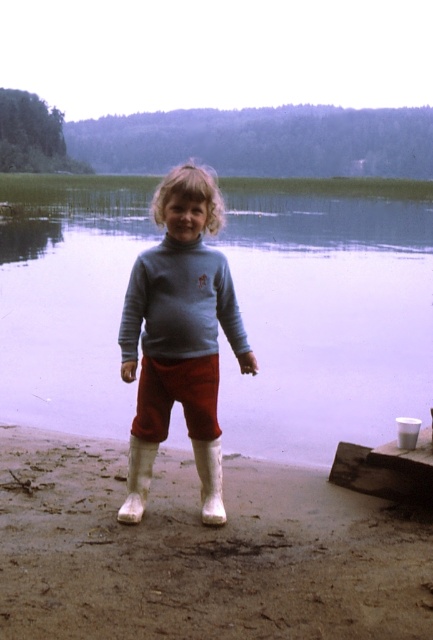
Between brown sandy beach at lower center and matte blue sweater at center, which one appears on the left side from the viewer's perspective?

brown sandy beach at lower center is more to the left.

Between point (190, 520) and point (145, 369), which one is positioned behind?

The point (190, 520) is behind.

Describe the element at coordinates (200, 550) in the screenshot. I see `brown sandy beach at lower center` at that location.

Where is `brown sandy beach at lower center`? The width and height of the screenshot is (433, 640). brown sandy beach at lower center is located at coordinates (200, 550).

In the scene shown: Which is above, smooth water at center or brown sandy beach at lower center?

smooth water at center is higher up.

Does point (287, 444) lie behind point (364, 499)?

Yes, point (287, 444) is behind point (364, 499).

This screenshot has height=640, width=433. Find the location of `smooth water at center`. smooth water at center is located at coordinates (328, 312).

Can you confirm if smooth water at center is taller than matte blue sweater at center?

Correct, smooth water at center is much taller as matte blue sweater at center.

Is point (410, 243) in front of point (146, 404)?

No, (410, 243) is behind (146, 404).

The image size is (433, 640). In order to click on smooth water at center in this screenshot , I will do `click(328, 312)`.